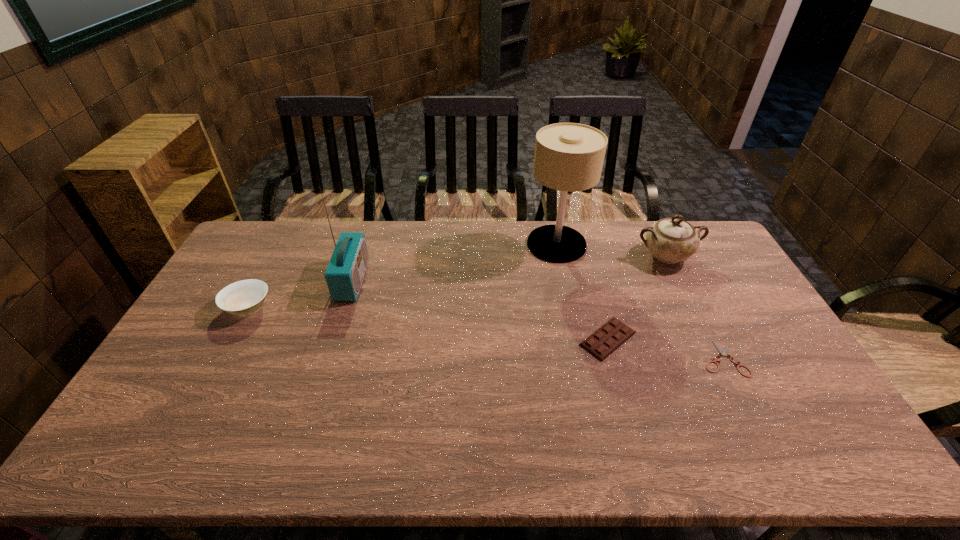
You are a GUI agent. You are given a task and a screenshot of the screen. Output one action in this format:
    pyautogui.click(x=<x>, y=<y>)
    Task: Click on the unoccupied position between the chinaware and the chocolate bar
    This screenshot has width=960, height=540.
    Given the screenshot: What is the action you would take?
    pyautogui.click(x=637, y=297)

I want to click on unoccupied area between the chinaware and the second object from left to right, so click(510, 268).

The height and width of the screenshot is (540, 960). In order to click on free area in between the fifth object from right to left and the chinaware in this screenshot , I will do `click(510, 268)`.

Find the location of a particular element. The width and height of the screenshot is (960, 540). vacant area that lies between the shears and the fifth shortest object is located at coordinates (538, 319).

Find the location of `vacant space that's between the tallest object and the fourth shortest object`. vacant space that's between the tallest object and the fourth shortest object is located at coordinates (612, 250).

Where is `object that is the nearest to the third shortest object`? This screenshot has width=960, height=540. object that is the nearest to the third shortest object is located at coordinates (345, 272).

Where is `object that is the fourth nearest to the shears`? This screenshot has width=960, height=540. object that is the fourth nearest to the shears is located at coordinates (345, 272).

Find the location of a particular element. free space that satisfies the following two spatial constraints: 1. on the front panel of the fifth shortest object; 2. on the right side of the shears is located at coordinates (327, 359).

You are a GUI agent. You are given a task and a screenshot of the screen. Output one action in this format:
    pyautogui.click(x=<x>, y=<y>)
    Task: Click on the free location that satisfies the following two spatial constraints: 1. on the front side of the table lamp; 2. on the right side of the third tallest object
    The image size is (960, 540).
    Given the screenshot: What is the action you would take?
    pyautogui.click(x=559, y=256)

Find the location of `free location that satisfies the following two spatial constraints: 1. on the front side of the third tallest object; 2. on the left side of the table lamp`. free location that satisfies the following two spatial constraints: 1. on the front side of the third tallest object; 2. on the left side of the table lamp is located at coordinates (559, 256).